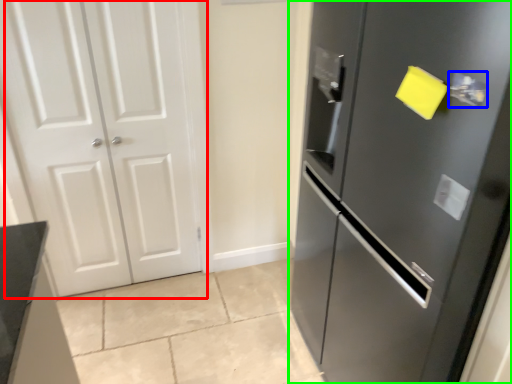
Question: Which object is the farthest from door (highlighted by a red box)? Choose among these: door handle (highlighted by a blue box) or door (highlighted by a green box).

Choices:
 (A) door handle
 (B) door

Answer: (A)